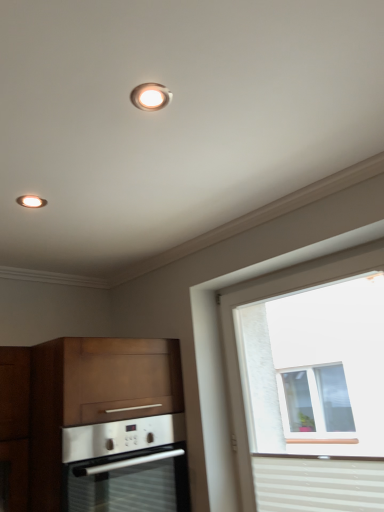
Question: Is white striped curtain at lower right located within matte white recessed light at upper center?

Choices:
 (A) no
 (B) yes

Answer: (A)

Question: Is white striped curtain at lower right at the back of matte white recessed light at upper center?

Choices:
 (A) no
 (B) yes

Answer: (A)

Question: Is matte white recessed light at upper center far from white striped curtain at lower right?

Choices:
 (A) no
 (B) yes

Answer: (B)

Question: Can you confirm if matte white recessed light at upper center is bigger than white striped curtain at lower right?

Choices:
 (A) yes
 (B) no

Answer: (B)

Question: Can you confirm if matte white recessed light at upper center is positioned to the right of white striped curtain at lower right?

Choices:
 (A) no
 (B) yes

Answer: (A)

Question: Considering the positions of wooden cabinet at lower left and satin silver oven at lower left in the image, is wooden cabinet at lower left wider or thinner than satin silver oven at lower left?

Choices:
 (A) wide
 (B) thin

Answer: (B)

Question: Visually, is wooden cabinet at lower left positioned to the left or to the right of satin silver oven at lower left?

Choices:
 (A) left
 (B) right

Answer: (A)

Question: From the image's perspective, is wooden cabinet at lower left positioned above or below satin silver oven at lower left?

Choices:
 (A) below
 (B) above

Answer: (B)

Question: In the image, is wooden cabinet at lower left positioned in front of or behind satin silver oven at lower left?

Choices:
 (A) behind
 (B) front

Answer: (A)

Question: From the image's perspective, is wooden cabinet at lower left positioned above or below white striped curtain at lower right?

Choices:
 (A) below
 (B) above

Answer: (B)

Question: Based on their sizes in the image, would you say wooden cabinet at lower left is bigger or smaller than white striped curtain at lower right?

Choices:
 (A) small
 (B) big

Answer: (B)

Question: Is wooden cabinet at lower left taller or shorter than white striped curtain at lower right?

Choices:
 (A) tall
 (B) short

Answer: (A)

Question: Would you say wooden cabinet at lower left is inside or outside white striped curtain at lower right?

Choices:
 (A) inside
 (B) outside

Answer: (B)

Question: Is satin silver oven at lower left taller or shorter than matte white recessed light at upper center?

Choices:
 (A) short
 (B) tall

Answer: (B)

Question: In terms of width, does satin silver oven at lower left look wider or thinner when compared to matte white recessed light at upper center?

Choices:
 (A) thin
 (B) wide

Answer: (B)